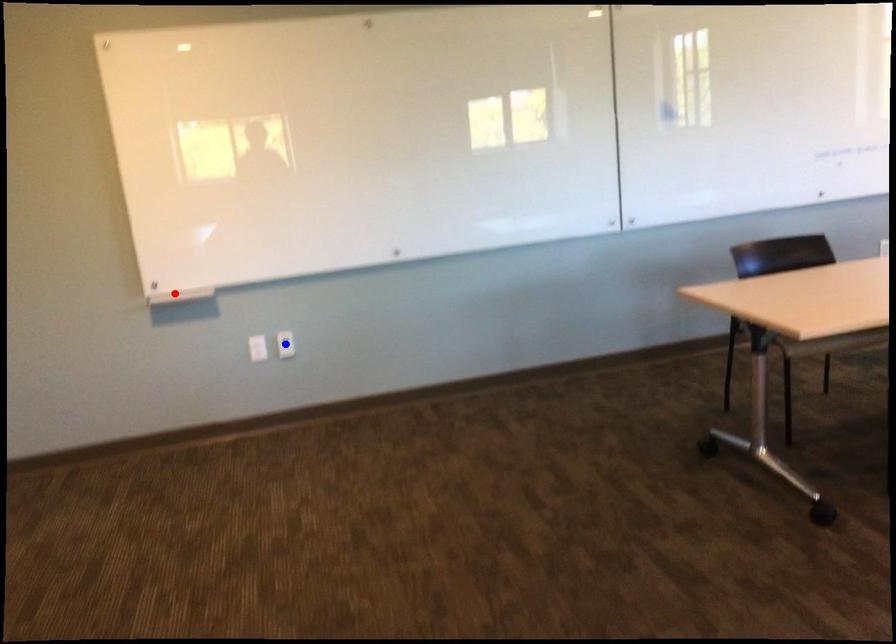
Question: Two points are marked on the image. Which point is closer to the camera?

Choices:
 (A) Blue point is closer.
 (B) Red point is closer.

Answer: (B)